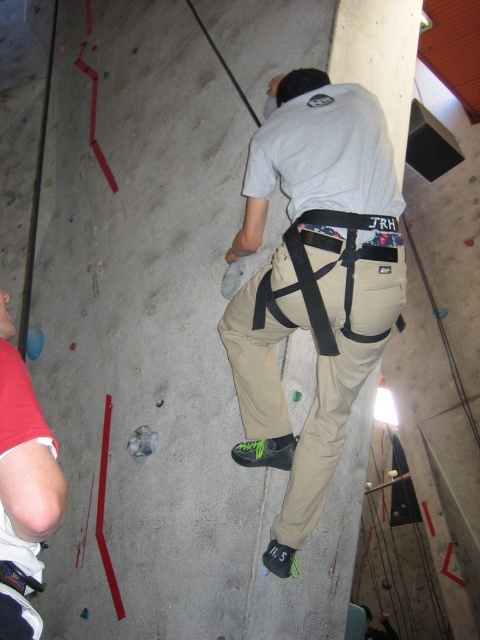
You are a safety inspector checking the climbing wall. You notice the khaki cotton pants at center represented by point (313, 284). What is the exact coordinate of the khaki cotton pants at center?

The khaki cotton pants at center is represented by point (313, 284).

You are a photographer setting up a shoot in the indoor rock climbing area. You need to position a light source so it illuminates the khaki cotton pants at center and the matte khaki pants at lower left equally. Given their widths, which pants require the light to be placed closer to them?

The matte khaki pants at lower left require the light to be placed closer because they are narrower than the khaki cotton pants at center, which is wider. A narrower object typically needs closer light placement to achieve even illumination compared to a wider object.

You are a photographer positioned at the camera. You want to take a photo that includes both the climber and the person on the left. Which of the two points, point (351, 314) or point (27, 456), is closer to your camera lens?

Point (351, 314) is further to the camera than point (27, 456), so the point closer to the camera lens is point (27, 456).